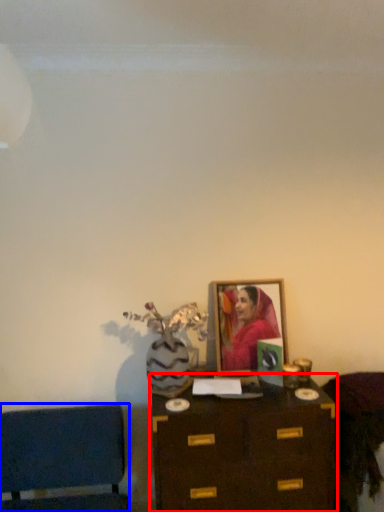
Question: Which of the following is the closest to the observer, table (highlighted by a red box) or furniture (highlighted by a blue box)?

Choices:
 (A) table
 (B) furniture

Answer: (B)